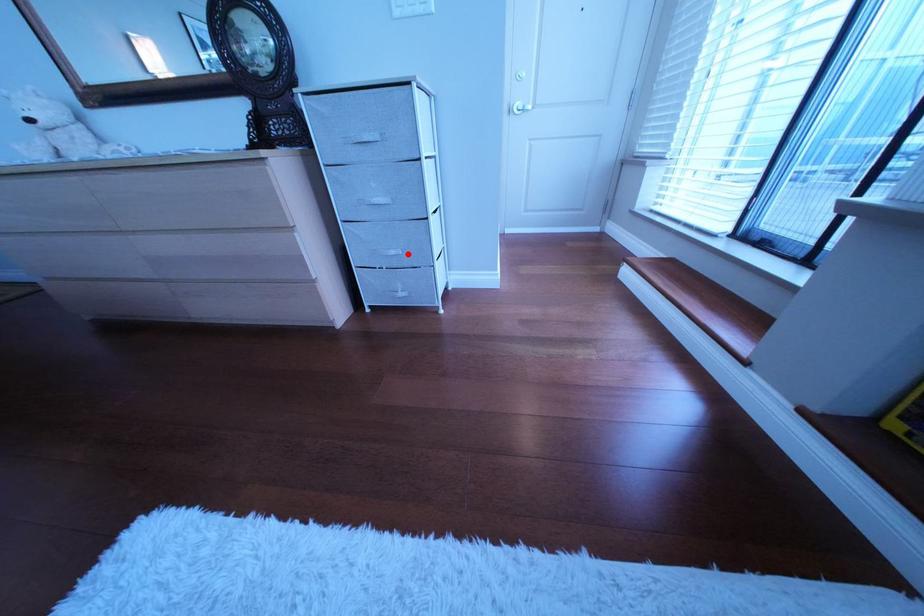
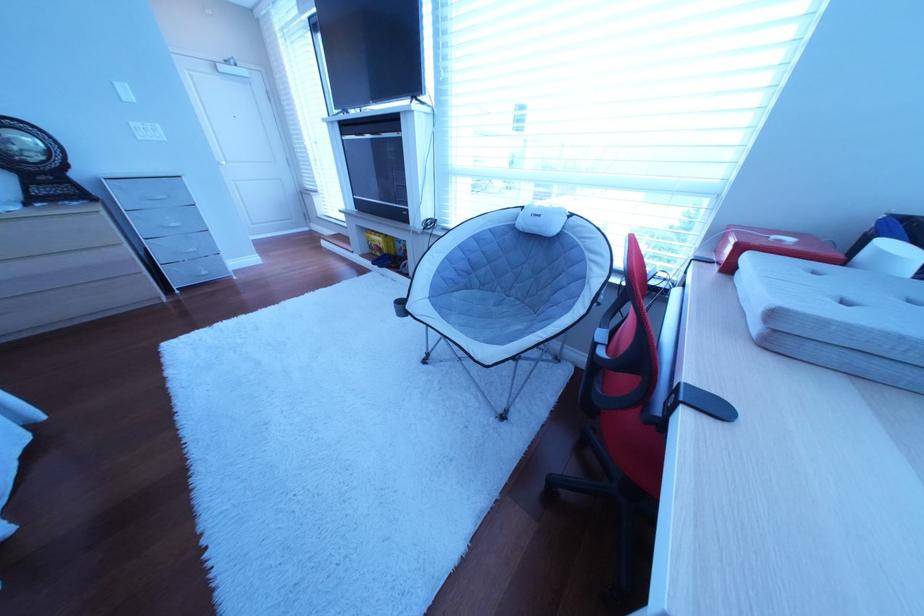
Locate, in the second image, the point that corresponds to the highlighted location in the first image.

(207, 252)